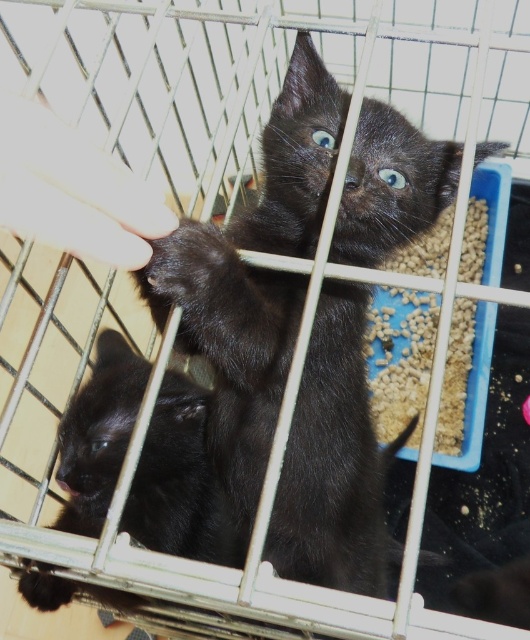
You are a veterinarian examining the cage with two kittens. You notice the shiny black kitten at lower left and the smooth skin hand at upper left. Which object is closer to the camera?

The shiny black kitten at lower left is closer to the camera because it is positioned under the smooth skin hand at upper left, meaning it is in front of the hand.

You are a photographer trying to capture the shiny black kitten at lower left in the center of your photo. Given its current position at coordinates, can you estimate whether it is already centered or needs to be moved left or right to be centered?

The shiny black kitten at lower left is located at coordinates point (180, 481). To center it, since the x coordinate is 0.753 which is greater than 0.5, the photographer should move the kitten to the left to align it with the center of the frame.